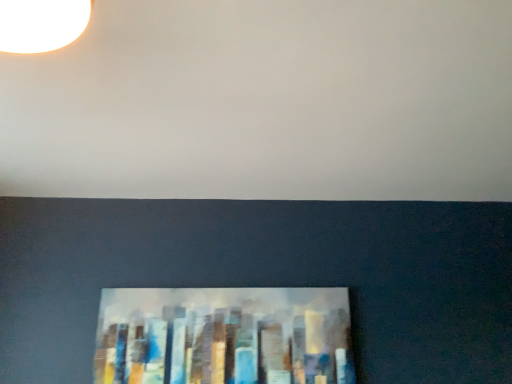
Question: From the image's perspective, is white matte wall at upper center below metallic abstract painting at lower center?

Choices:
 (A) no
 (B) yes

Answer: (A)

Question: Is white matte wall at upper center touching metallic abstract painting at lower center?

Choices:
 (A) no
 (B) yes

Answer: (A)

Question: Considering the relative sizes of white matte wall at upper center and metallic abstract painting at lower center in the image provided, is white matte wall at upper center taller than metallic abstract painting at lower center?

Choices:
 (A) no
 (B) yes

Answer: (A)

Question: Is white matte wall at upper center not near metallic abstract painting at lower center?

Choices:
 (A) yes
 (B) no

Answer: (B)

Question: From the image's perspective, is white matte wall at upper center over metallic abstract painting at lower center?

Choices:
 (A) no
 (B) yes

Answer: (B)

Question: Could metallic abstract painting at lower center be considered to be inside white matte wall at upper center?

Choices:
 (A) yes
 (B) no

Answer: (B)

Question: Is metallic abstract painting at lower center closer to the viewer compared to white matte wall at upper center?

Choices:
 (A) no
 (B) yes

Answer: (A)

Question: Is metallic abstract painting at lower center wider than white matte wall at upper center?

Choices:
 (A) no
 (B) yes

Answer: (A)

Question: From a real-world perspective, is metallic abstract painting at lower center on white matte wall at upper center?

Choices:
 (A) yes
 (B) no

Answer: (B)

Question: Does metallic abstract painting at lower center turn towards white matte wall at upper center?

Choices:
 (A) yes
 (B) no

Answer: (B)

Question: Is metallic abstract painting at lower center located outside white matte wall at upper center?

Choices:
 (A) no
 (B) yes

Answer: (B)

Question: Is metallic abstract painting at lower center bigger than white matte wall at upper center?

Choices:
 (A) no
 (B) yes

Answer: (A)

Question: In terms of size, does white matte wall at upper center appear bigger or smaller than metallic abstract painting at lower center?

Choices:
 (A) big
 (B) small

Answer: (A)